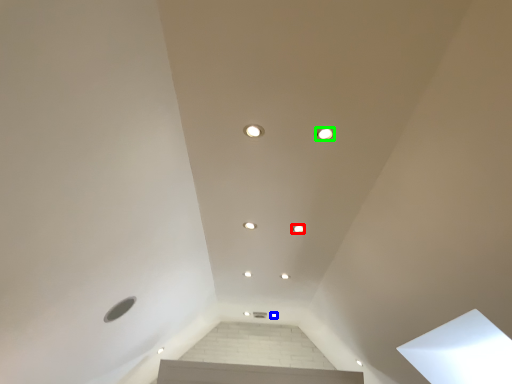
Question: Considering the real-world distances, which object is farthest from dot (highlighted by a red box)? dot (highlighted by a blue box) or dot (highlighted by a green box)?

Choices:
 (A) dot
 (B) dot

Answer: (A)